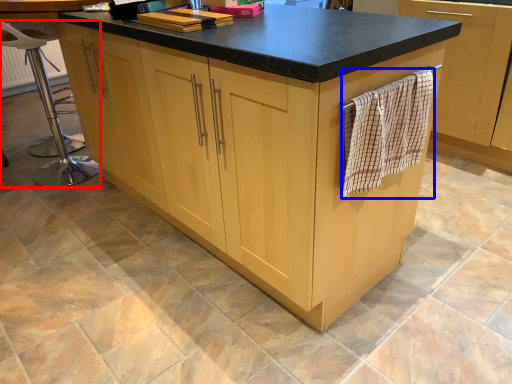
Question: Which point is further to the camera, bar stool (highlighted by a red box) or bath towel (highlighted by a blue box)?

Choices:
 (A) bar stool
 (B) bath towel

Answer: (A)